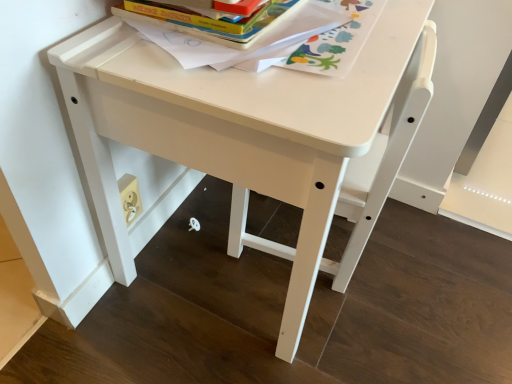
Locate an element on the screen. vacant area that is in front of hardcover book at upper center is located at coordinates (218, 78).